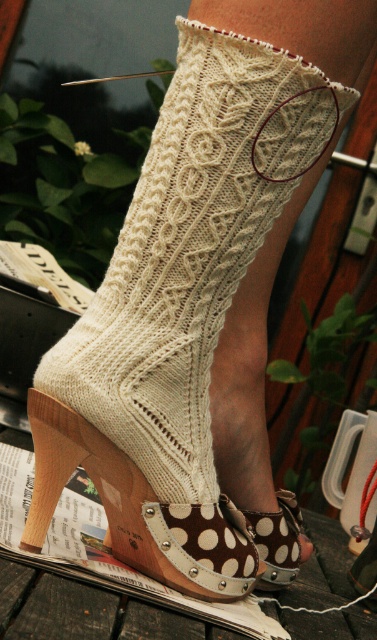
Between white knitted sock at center and brown polka dot fabric sandal at lower center, which one appears on the left side from the viewer's perspective?

Positioned to the left is brown polka dot fabric sandal at lower center.

Does white knitted sock at center have a greater width compared to brown polka dot fabric sandal at lower center?

Yes, white knitted sock at center is wider than brown polka dot fabric sandal at lower center.

What do you see at coordinates (194, 248) in the screenshot? The width and height of the screenshot is (377, 640). I see `white knitted sock at center` at bounding box center [194, 248].

Locate an element on the screen. The height and width of the screenshot is (640, 377). white knitted sock at center is located at coordinates (194, 248).

Is point (165, 525) positioned in front of point (283, 568)?

Yes, point (165, 525) is in front of point (283, 568).

Where is `brown polka dot fabric sandal at lower center`? The height and width of the screenshot is (640, 377). brown polka dot fabric sandal at lower center is located at coordinates (137, 509).

Who is lower down, white knitted sock at center or brown polka dot fabric shoe at lower center?

Positioned lower is brown polka dot fabric shoe at lower center.

What do you see at coordinates (194, 248) in the screenshot? I see `white knitted sock at center` at bounding box center [194, 248].

Describe the element at coordinates (194, 248) in the screenshot. I see `white knitted sock at center` at that location.

The width and height of the screenshot is (377, 640). I want to click on white knitted sock at center, so click(x=194, y=248).